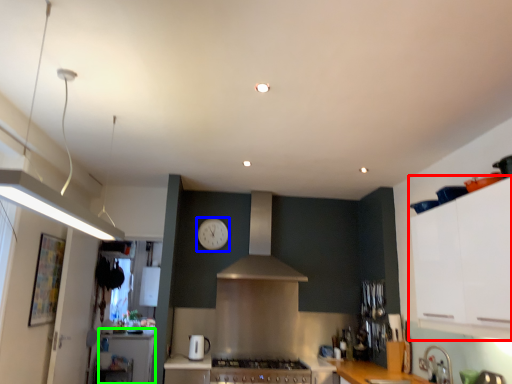
Question: Which object is the closest to the cabinetry (highlighted by a red box)? Choose among these: clock (highlighted by a blue box) or counter top (highlighted by a green box).

Choices:
 (A) clock
 (B) counter top

Answer: (A)